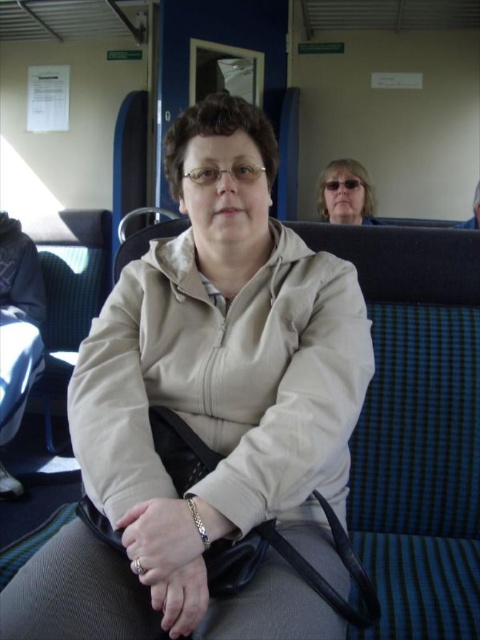
You are a passenger on a train and want to know the position of your belongings. You have a beige fabric jacket at center and a silver metallic bracelet at lower center. Which item is located to the right?

The silver metallic bracelet at lower center is located to the right of the beige fabric jacket at center.

You are a passenger on a train and you want to know if the beige fabric jacket at center is taller than the matte black sunglasses at upper center. Can you confirm this?

The beige fabric jacket at center has a greater height compared to the matte black sunglasses at upper center, so yes, the beige fabric jacket at center is taller than the matte black sunglasses at upper center.

You are sitting at point (320, 212) in the train. You want to reach the exit door located at point (223, 486). Is the exit door in front of you or behind you?

The exit door at point (223, 486) is in front of you because it is in front of point (320, 212) where you are sitting.